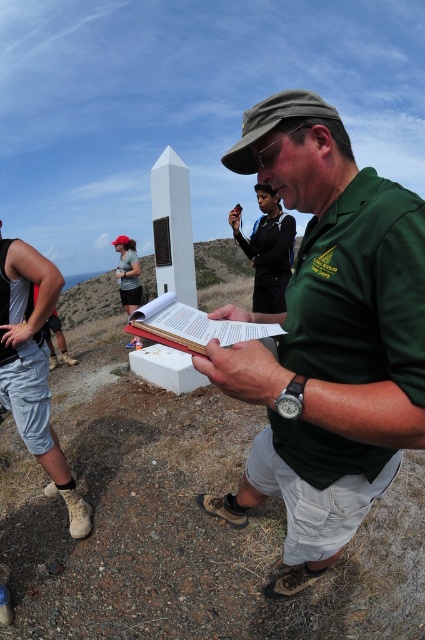
You are a photographer trying to capture a clear photo of the green fabric shirt at center and the white paper book at center. Which object should you focus on first if you want to ensure both are in focus without adjusting the camera settings?

The green fabric shirt at center has a larger size compared to the white paper book at center, so you should focus on the green fabric shirt at center first to ensure both are in focus.

You are a photographer trying to capture both the green fabric shirt at center and the black fabric shirt at center in a single shot. Based on their heights, which one should you focus on to ensure both are fully visible in the frame?

The green fabric shirt at center is much taller than the black fabric shirt at center, so you should focus on the green fabric shirt at center to ensure both are fully visible in the frame.